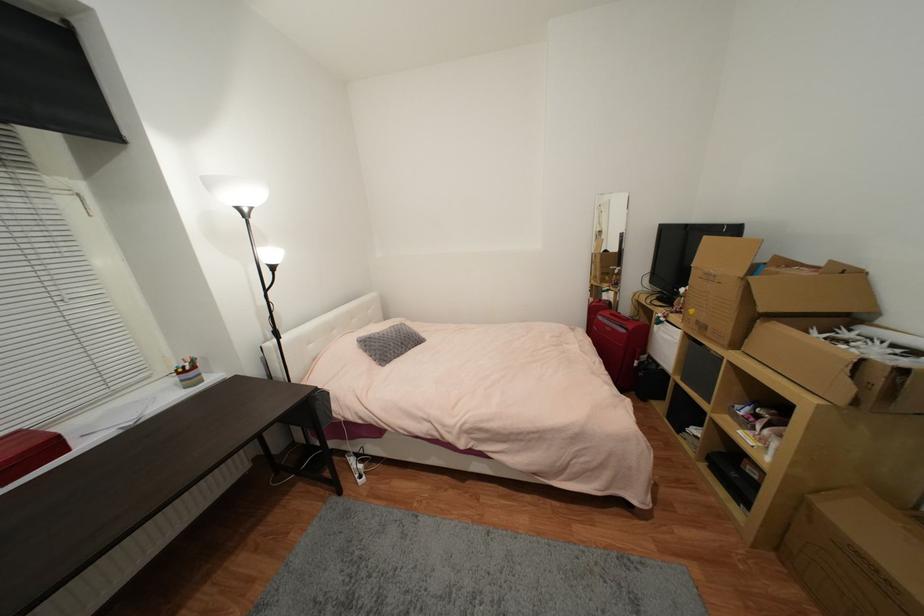
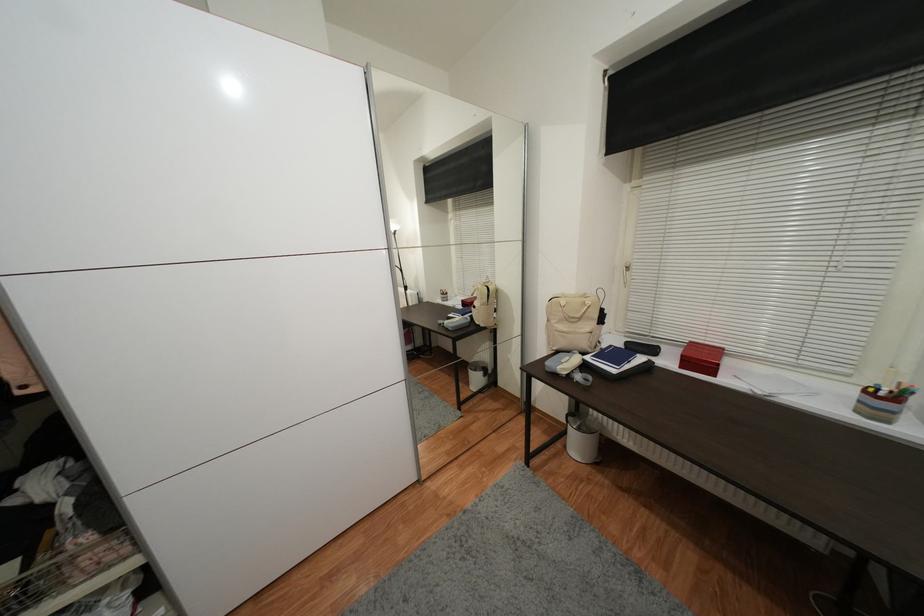
Where in the second image is the point corresponding to [185,374] from the first image?

(871, 392)